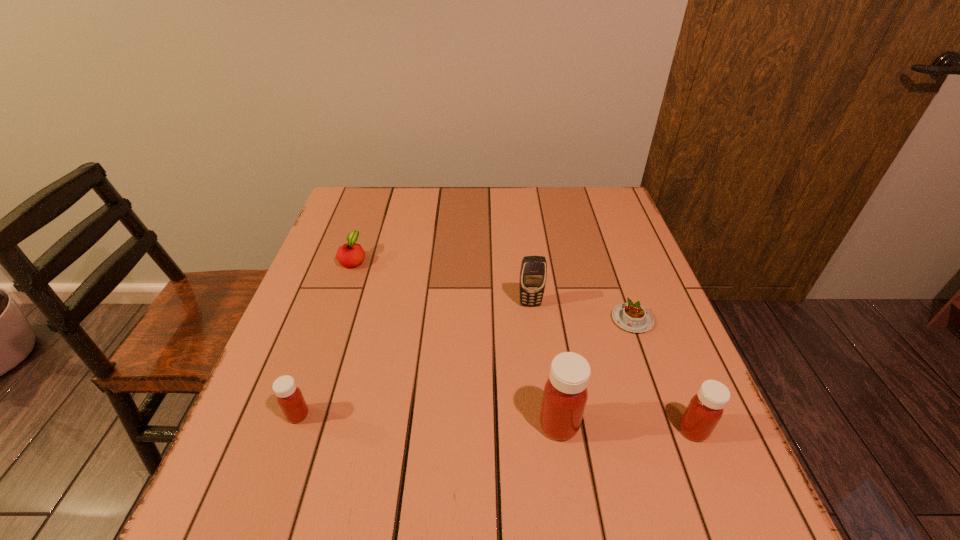
This screenshot has height=540, width=960. I want to click on location for an additional medicine to make spacing equal, so click(x=427, y=420).